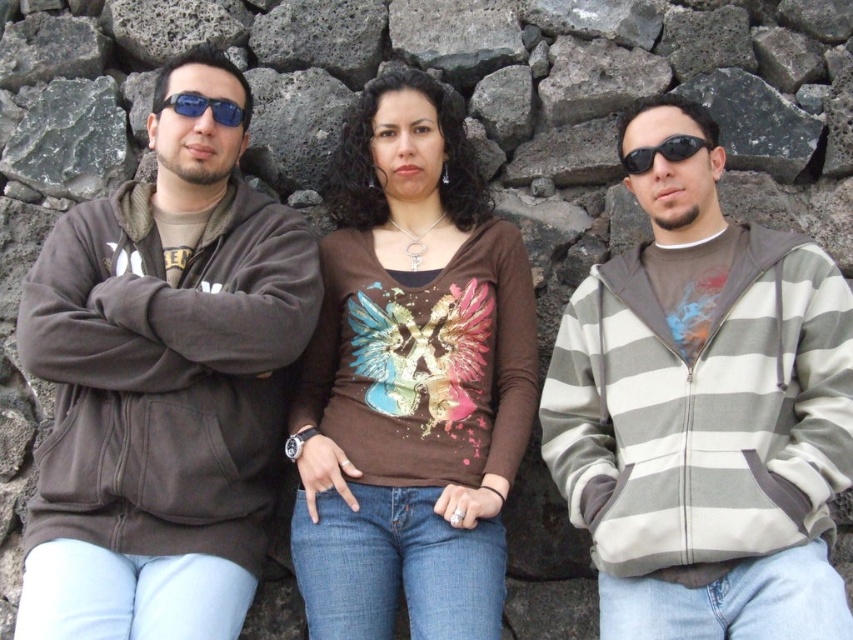
Question: In this image, where is matte brown hoodie at left located relative to black plastic sunglasses at center?

Choices:
 (A) left
 (B) right

Answer: (A)

Question: Is striped fleece jacket at right smaller than black plastic sunglasses at center?

Choices:
 (A) no
 (B) yes

Answer: (A)

Question: Is striped fleece jacket at right thinner than black plastic sunglasses at center?

Choices:
 (A) no
 (B) yes

Answer: (A)

Question: Among these objects, which one is farthest from the camera?

Choices:
 (A) blue reflective sunglasses at center
 (B) striped fleece jacket at right
 (C) black plastic sunglasses at center

Answer: (A)

Question: Based on their relative distances, which object is nearer to the blue reflective sunglasses at center?

Choices:
 (A) matte brown hoodie at left
 (B) black plastic sunglasses at center
 (C) striped fleece jacket at right

Answer: (A)

Question: Among these objects, which one is farthest from the camera?

Choices:
 (A) striped fleece jacket at right
 (B) matte brown hoodie at left

Answer: (B)